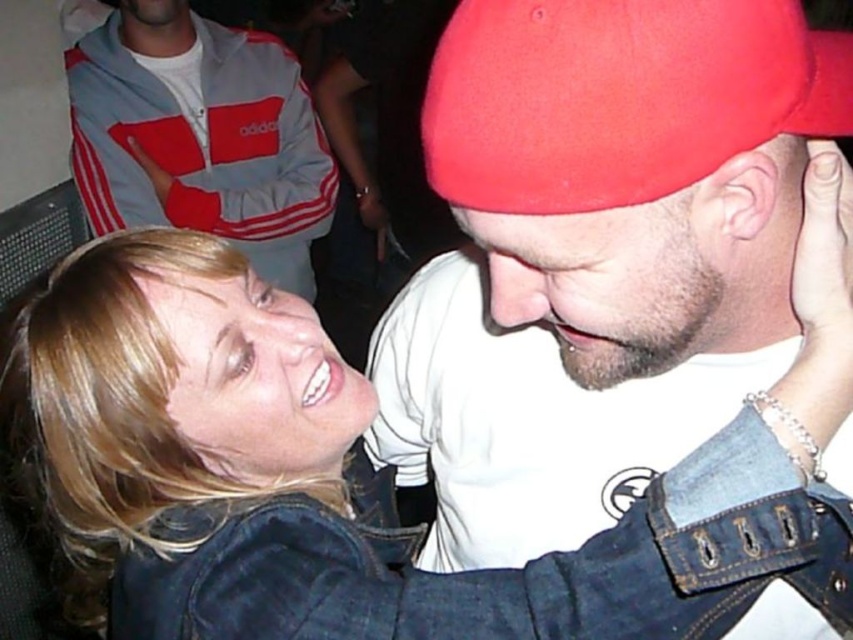
Question: Which point appears closest to the camera in this image?

Choices:
 (A) (68, 268)
 (B) (583, 340)
 (C) (570, 144)

Answer: (C)

Question: Considering the real-world distances, which object is closest to the red matte beanie at center?

Choices:
 (A) denim jacket at lower right
 (B) blonde hair at upper left
 (C) gray adidas track jacket at upper left

Answer: (A)

Question: In this image, where is beige matte skin at center located relative to blonde hair at upper left?

Choices:
 (A) above
 (B) below

Answer: (A)

Question: Which of these objects is positioned closest to the red cotton cap at upper center?

Choices:
 (A) beige matte skin at center
 (B) red matte beanie at center
 (C) denim jacket at lower right
 (D) gray adidas track jacket at upper left

Answer: (A)

Question: Is red cotton cap at upper center closer to the viewer compared to gray adidas track jacket at upper left?

Choices:
 (A) no
 (B) yes

Answer: (B)

Question: Does denim jacket at lower right appear under gray adidas track jacket at upper left?

Choices:
 (A) no
 (B) yes

Answer: (B)